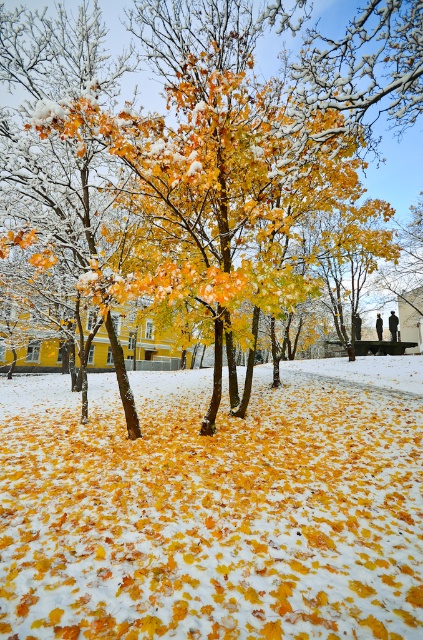
Question: Which point is farther to the camera?

Choices:
 (A) yellow matte tree at center
 (B) yellow matte leaves at center

Answer: (A)

Question: Can you confirm if yellow matte leaves at center is wider than yellow matte tree at center?

Choices:
 (A) no
 (B) yes

Answer: (A)

Question: From the image, what is the correct spatial relationship of yellow matte leaves at center in relation to yellow matte tree at center?

Choices:
 (A) above
 (B) below

Answer: (B)

Question: Which point is farther to the camera?

Choices:
 (A) yellow matte tree at center
 (B) yellow matte leaves at center

Answer: (A)

Question: Is yellow matte leaves at center positioned behind yellow matte tree at center?

Choices:
 (A) no
 (B) yes

Answer: (A)